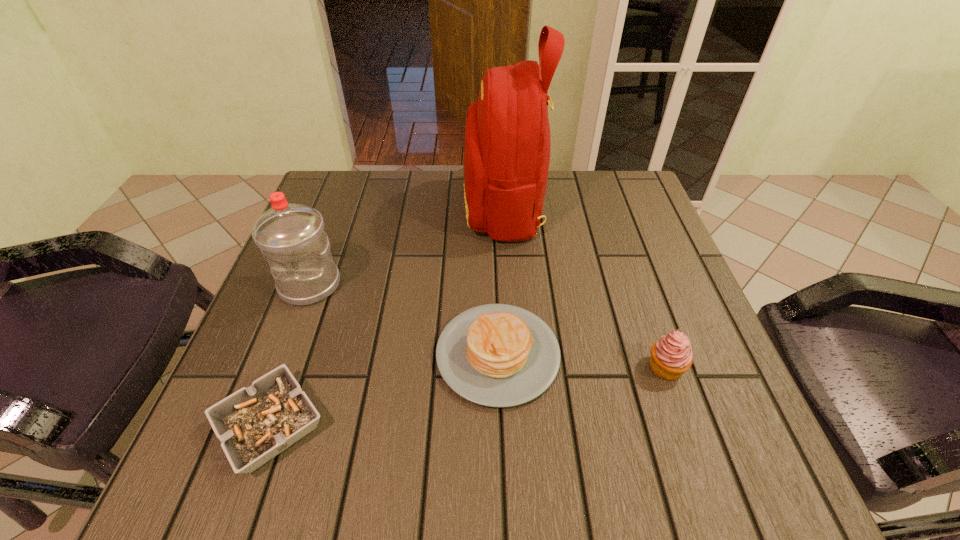
I want to click on vacant space located 0.250m on the handle side of the water bottle, so click(x=257, y=424).

The height and width of the screenshot is (540, 960). Identify the location of free space located on the back of the cupcake. (648, 318).

Image resolution: width=960 pixels, height=540 pixels. I want to click on free space located on the back of the fourth tallest object, so click(493, 225).

In order to click on vacant position located on the right of the ashtray in this screenshot , I will do `click(371, 426)`.

Where is `object that is at the far edge`? The height and width of the screenshot is (540, 960). object that is at the far edge is located at coordinates (507, 146).

Identify the location of object at the near edge. The height and width of the screenshot is (540, 960). (254, 424).

Locate an element on the screen. water bottle that is at the left edge is located at coordinates pos(291,237).

This screenshot has width=960, height=540. I want to click on ashtray located in the left edge section of the desktop, so click(x=254, y=424).

At what (x,y) coordinates should I click in order to perform the action: click on object located in the right edge section of the desktop. Please return your answer as a coordinate pair (x, y). Looking at the image, I should click on (671, 356).

Where is `object present at the near left corner`? The image size is (960, 540). object present at the near left corner is located at coordinates (254, 424).